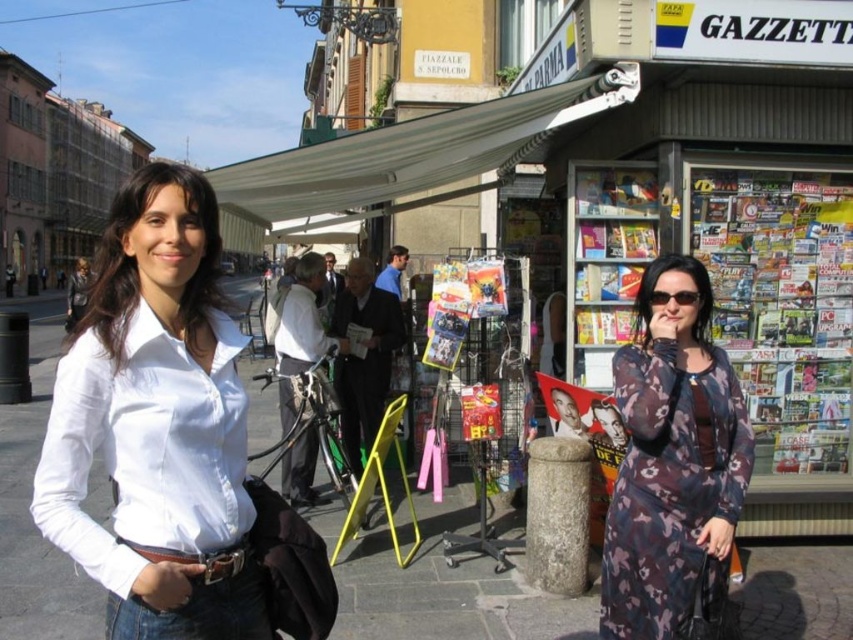
You are standing in the middle of the street looking at the newsstand. There are two points marked in the image. The first point is at coordinates point (135,433) and the second is at point (685,291). Which point is closer to you?

The point at coordinates point (135,433) is closer to you than the point at (685,291).

In the scene shown: You are a tourist in Italy and want to buy a souvenir. You notice the white fabric canopy at upper center and the matte black sunglasses at center. Which item is larger in size?

The white fabric canopy at upper center is bigger than the matte black sunglasses at center.